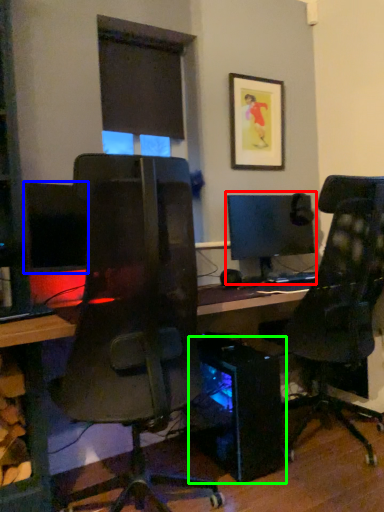
Question: Based on their relative distances, which object is nearer to computer monitor (highlighted by a red box)? Choose from computer monitor (highlighted by a blue box) and computer tower (highlighted by a green box).

Choices:
 (A) computer monitor
 (B) computer tower

Answer: (B)